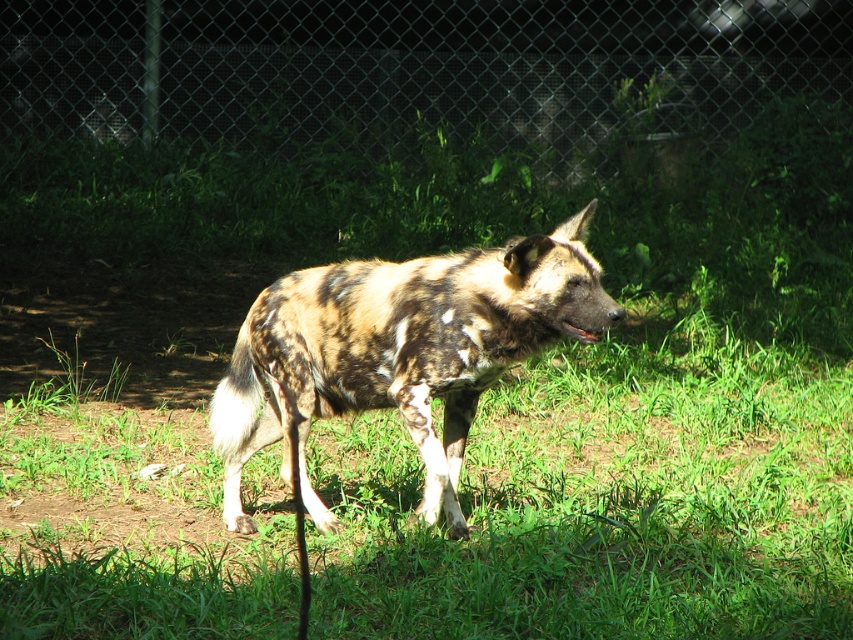
Question: Estimate the real-world distances between objects in this image. Which object is closer to the spotted fur dog at center?

Choices:
 (A) brown fur mouth at center
 (B) green chain-link fence at upper center

Answer: (A)

Question: Does green chain-link fence at upper center come behind brown fur mouth at center?

Choices:
 (A) no
 (B) yes

Answer: (B)

Question: Considering the real-world distances, which object is closest to the spotted fur dog at center?

Choices:
 (A) green chain-link fence at upper center
 (B) brown fur mouth at center

Answer: (B)

Question: Is green chain-link fence at upper center to the left of spotted fur dog at center from the viewer's perspective?

Choices:
 (A) yes
 (B) no

Answer: (B)

Question: Among these points, which one is nearest to the camera?

Choices:
 (A) (595, 337)
 (B) (550, 326)
 (C) (335, 112)

Answer: (A)

Question: Considering the relative positions of green chain-link fence at upper center and brown fur mouth at center in the image provided, where is green chain-link fence at upper center located with respect to brown fur mouth at center?

Choices:
 (A) right
 (B) left

Answer: (A)